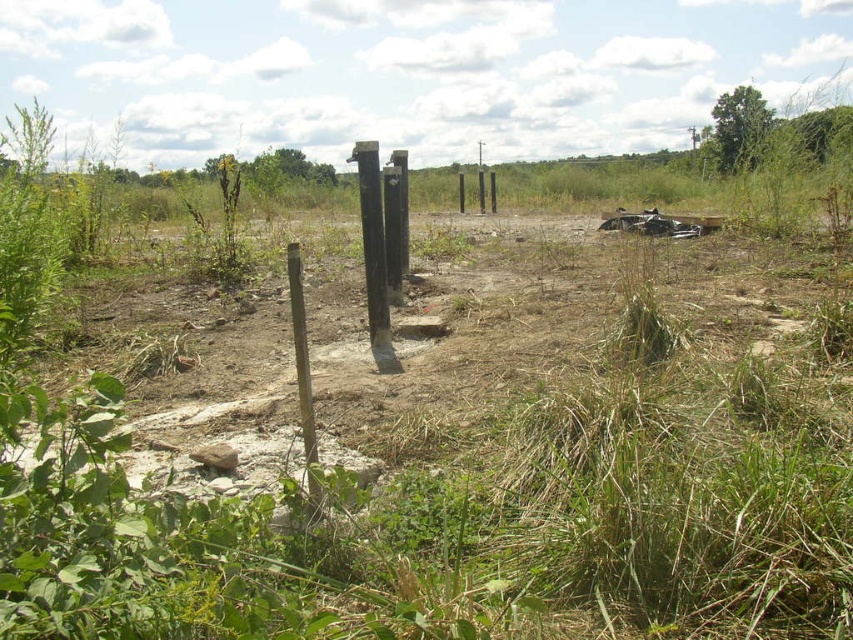
Question: Is the position of brown dirt field at center more distant than that of black wood post at center?

Choices:
 (A) yes
 (B) no

Answer: (B)

Question: Is brown dirt field at center to the left of black wood post at center from the viewer's perspective?

Choices:
 (A) no
 (B) yes

Answer: (A)

Question: Which object appears farthest from the camera in this image?

Choices:
 (A) black wood post at center
 (B) brown dirt field at center

Answer: (A)

Question: Is brown dirt field at center smaller than black wood post at center?

Choices:
 (A) no
 (B) yes

Answer: (A)